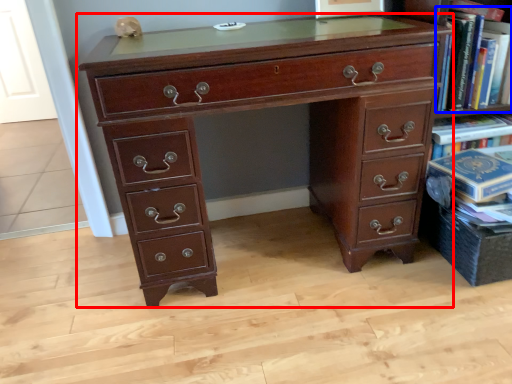
Question: Among these objects, which one is farthest to the camera, chest of drawers (highlighted by a red box) or book (highlighted by a blue box)?

Choices:
 (A) chest of drawers
 (B) book

Answer: (B)